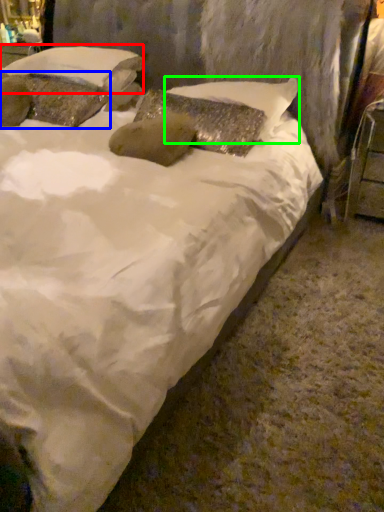
Question: Which object is positioned closest to pillow (highlighted by a red box)? Select from pillow (highlighted by a blue box) and pillow (highlighted by a green box).

Choices:
 (A) pillow
 (B) pillow

Answer: (A)